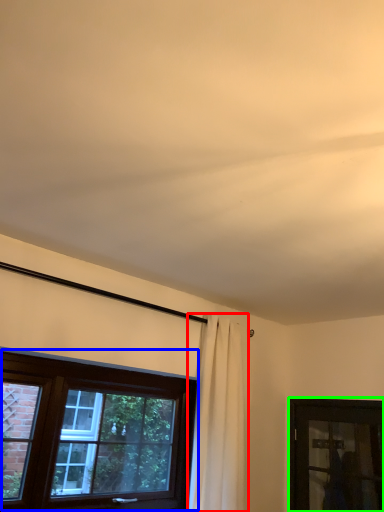
Question: Considering the real-world distances, which object is closest to curtain (highlighted by a red box)? window (highlighted by a blue box) or window (highlighted by a green box).

Choices:
 (A) window
 (B) window

Answer: (A)